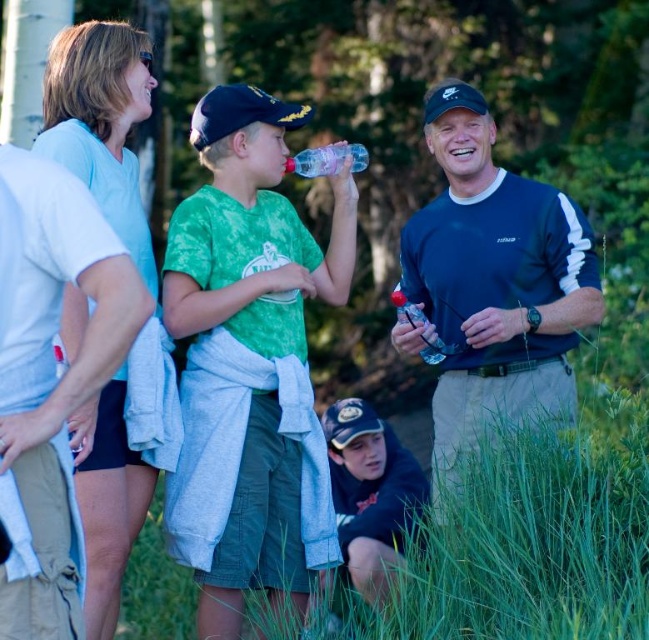
You are a hiker who needs to pack your backpack. You have a dark blue sweatshirt at center and a clear plastic bottle at center. Which item takes up more space in your backpack?

The dark blue sweatshirt at center is larger in size than the clear plastic bottle at center, so the dark blue sweatshirt at center takes up more space in the backpack.